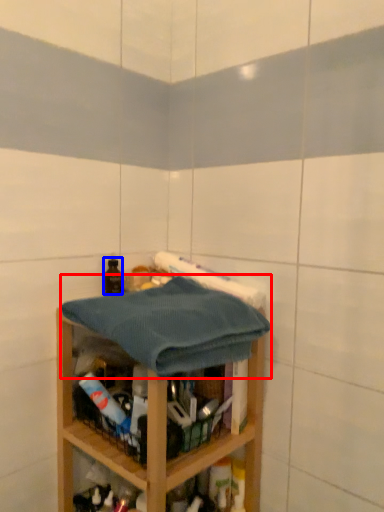
Question: Which object is closer to the camera taking this photo, bath towel (highlighted by a red box) or bottle (highlighted by a blue box)?

Choices:
 (A) bath towel
 (B) bottle

Answer: (A)